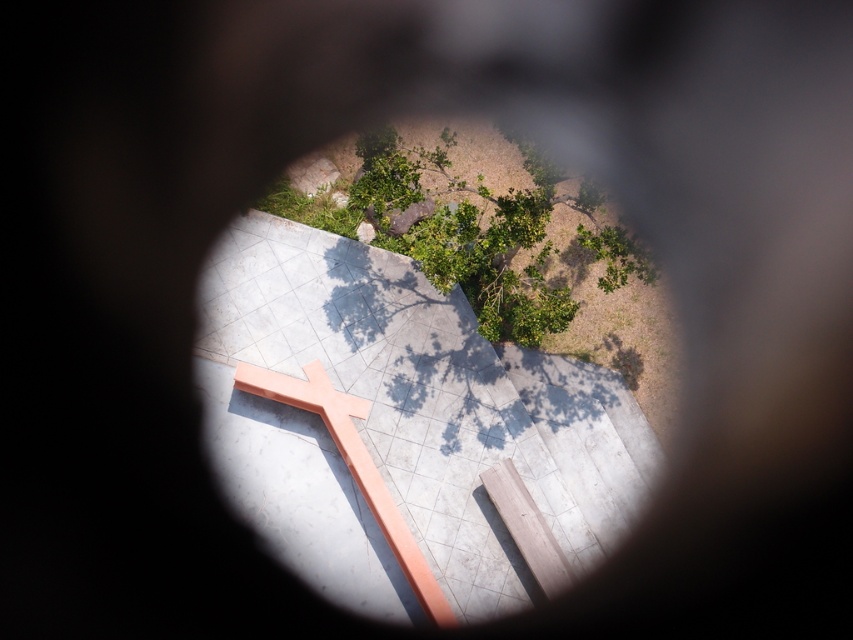
Question: Is green leafy tree at upper center closer to the viewer compared to peach wood cross at center?

Choices:
 (A) no
 (B) yes

Answer: (B)

Question: Which of the following is the farthest from the observer?

Choices:
 (A) green leafy tree at upper center
 (B) peach wood cross at center

Answer: (B)

Question: Which point is closer to the camera?

Choices:
 (A) peach wood cross at center
 (B) green leafy tree at upper center

Answer: (B)

Question: Can you confirm if green leafy tree at upper center is smaller than peach wood cross at center?

Choices:
 (A) yes
 (B) no

Answer: (B)

Question: Does green leafy tree at upper center appear on the left side of peach wood cross at center?

Choices:
 (A) yes
 (B) no

Answer: (B)